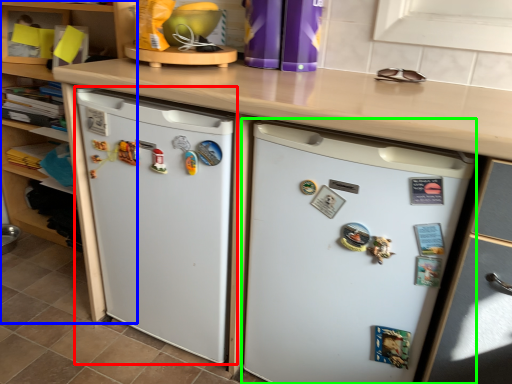
Question: Which object is positioned farthest from refrigerator (highlighted by a red box)? Select from cabinetry (highlighted by a blue box) and refrigerator (highlighted by a green box).

Choices:
 (A) cabinetry
 (B) refrigerator

Answer: (A)